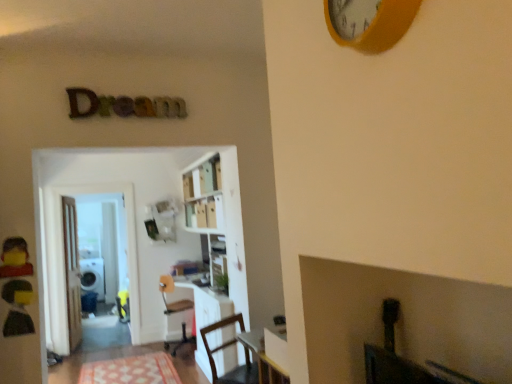
Question: Does wooden chair at lower center, acting as the 1th chair starting from the right, turn towards white glossy bookcase at center?

Choices:
 (A) yes
 (B) no

Answer: (B)

Question: Does wooden chair at lower center, which ranks as the 2th chair in left-to-right order, have a greater height compared to white glossy bookcase at center?

Choices:
 (A) no
 (B) yes

Answer: (A)

Question: From a real-world perspective, is wooden chair at lower center, marked as the first chair in a front-to-back arrangement, on top of white glossy bookcase at center?

Choices:
 (A) no
 (B) yes

Answer: (A)

Question: Can you confirm if wooden chair at lower center, acting as the 1th chair starting from the right, is wider than white glossy bookcase at center?

Choices:
 (A) yes
 (B) no

Answer: (B)

Question: Does wooden chair at lower center, marked as the first chair in a front-to-back arrangement, contain white glossy bookcase at center?

Choices:
 (A) no
 (B) yes

Answer: (A)

Question: From a real-world perspective, is wooden chair at lower center, the 2th chair viewed from the back, below white glossy bookcase at center?

Choices:
 (A) yes
 (B) no

Answer: (A)

Question: From the image's perspective, is white glossy bookcase at center below patterned fabric mat at lower center?

Choices:
 (A) no
 (B) yes

Answer: (A)

Question: Considering the relative sizes of white glossy bookcase at center and patterned fabric mat at lower center in the image provided, is white glossy bookcase at center thinner than patterned fabric mat at lower center?

Choices:
 (A) yes
 (B) no

Answer: (A)

Question: Are white glossy bookcase at center and patterned fabric mat at lower center located far from each other?

Choices:
 (A) no
 (B) yes

Answer: (B)

Question: Considering the relative sizes of white glossy bookcase at center and patterned fabric mat at lower center in the image provided, is white glossy bookcase at center wider than patterned fabric mat at lower center?

Choices:
 (A) no
 (B) yes

Answer: (A)

Question: Is white glossy bookcase at center closer to camera compared to patterned fabric mat at lower center?

Choices:
 (A) no
 (B) yes

Answer: (B)

Question: Is white glossy bookcase at center at the right side of patterned fabric mat at lower center?

Choices:
 (A) no
 (B) yes

Answer: (B)

Question: Is yellow matte clock at upper center positioned far away from white glossy bookcase at center?

Choices:
 (A) yes
 (B) no

Answer: (A)